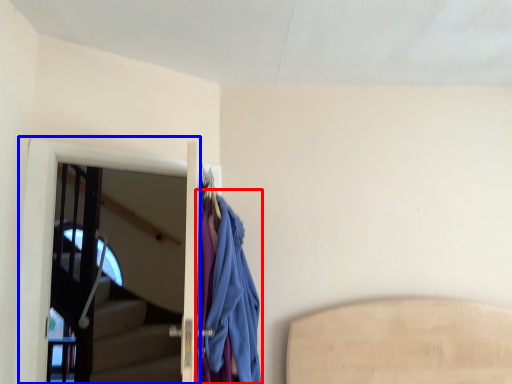
Question: Which point is further to the camera, cloak (highlighted by a red box) or screen door (highlighted by a blue box)?

Choices:
 (A) cloak
 (B) screen door

Answer: (B)